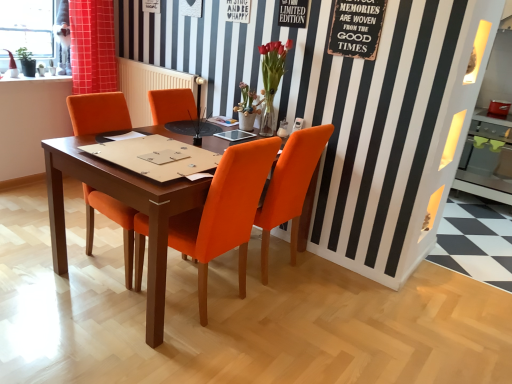
Image resolution: width=512 pixels, height=384 pixels. Identify the location of vacant space to the right of wooden table at center. (370, 315).